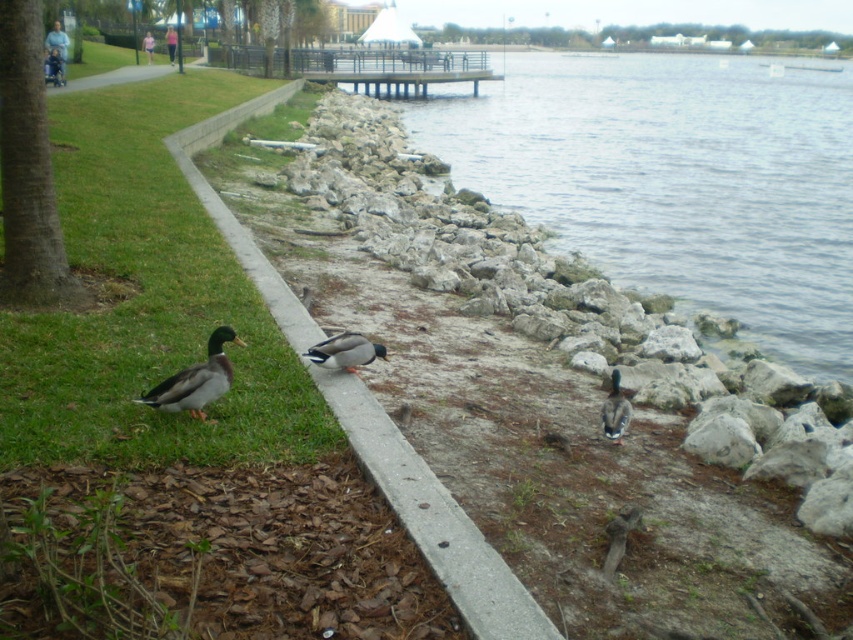
Is green grass at lower left bigger than green glossy duck at center?

Indeed, green grass at lower left has a larger size compared to green glossy duck at center.

Identify the location of green grass at lower left. Image resolution: width=853 pixels, height=640 pixels. (148, 300).

Does point (216, 328) come behind point (611, 397)?

Yes, point (216, 328) is behind point (611, 397).

Is point (155, 396) positioned behind point (612, 401)?

No, (155, 396) is closer to viewer.

Identify the location of green glossy duck at lower left. coord(196,380).

Does green glossy duck at lower left appear on the left side of green-feathered duck at center?

Yes, green glossy duck at lower left is to the left of green-feathered duck at center.

Which is below, green glossy duck at lower left or green-feathered duck at center?

green glossy duck at lower left is lower down.

Describe the element at coordinates (196, 380) in the screenshot. I see `green glossy duck at lower left` at that location.

Find the location of a particular element. Image resolution: width=853 pixels, height=640 pixels. green glossy duck at lower left is located at coordinates (196, 380).